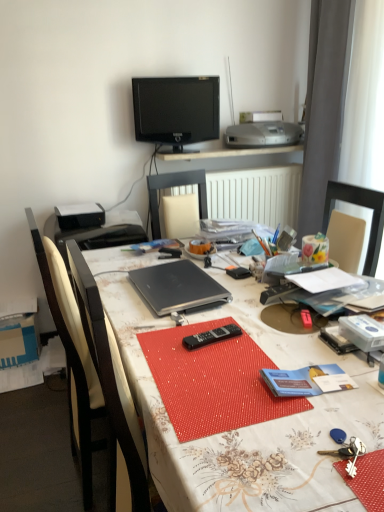
The image size is (384, 512). Describe the element at coordinates (177, 287) in the screenshot. I see `black matte laptop at center` at that location.

Locate an element on the screen. black plastic remote control at center, which is the second stationery from right to left is located at coordinates (239, 273).

What is the approximate width of black plastic remote control at center, the first stationery in the left-to-right sequence?

black plastic remote control at center, the first stationery in the left-to-right sequence, is 4.46 inches in width.

Measure the distance between matte black laptop at center and camera.

matte black laptop at center and camera are 27.18 inches apart from each other.

The height and width of the screenshot is (512, 384). Find the location of `matte black laptop at center`. matte black laptop at center is located at coordinates (246, 426).

I want to click on black glossy television at upper center, so click(176, 110).

This screenshot has width=384, height=512. What do you see at coordinates (264, 133) in the screenshot? I see `satin silver printer at upper center` at bounding box center [264, 133].

Identify the location of satin silver printer at upper center. Image resolution: width=384 pixels, height=512 pixels. [264, 133].

Locate an element on the screen. The image size is (384, 512). black matte laptop at center is located at coordinates (177, 287).

From the image's perspective, is black matte laptop at center positioned above or below black wood chair at left?

Based on their image positions, black matte laptop at center is located above black wood chair at left.

From the picture: Can you confirm if black matte laptop at center is taller than black wood chair at left?

No, black matte laptop at center is not taller than black wood chair at left.

Is black matte laptop at center placed right next to black wood chair at left?

There is a gap between black matte laptop at center and black wood chair at left.

Is black matte laptop at center inside the boundaries of black wood chair at left, or outside?

black matte laptop at center is enclosed within black wood chair at left.

From the image's perspective, is black glossy television at upper center located above matte black laptop at center?

Indeed, from the image's perspective, black glossy television at upper center is shown above matte black laptop at center.

From the picture: From a real-world perspective, is black glossy television at upper center positioned over matte black laptop at center based on gravity?

Yes, from a real-world perspective, black glossy television at upper center is above matte black laptop at center.

Can you confirm if black glossy television at upper center is smaller than matte black laptop at center?

Indeed, black glossy television at upper center has a smaller size compared to matte black laptop at center.

Considering the positions of objects matte black laptop at center and floral paper towel at upper right, which appears as the 1th stationery when viewed from the right, in the image provided, who is more to the right, matte black laptop at center or floral paper towel at upper right, which appears as the 1th stationery when viewed from the right,?

floral paper towel at upper right, which appears as the 1th stationery when viewed from the right.

In order to click on the 2nd stationery directly above the matte black laptop at center (from a real-world perspective) in this screenshot , I will do `click(315, 248)`.

Looking at this image, from a real-world perspective, is matte black laptop at center positioned under floral paper towel at upper right, which appears as the 1th stationery when viewed from the right, based on gravity?

Yes.

Is matte black laptop at center positioned before floral paper towel at upper right, which appears as the 1th stationery when viewed from the right?

Yes, it is in front of floral paper towel at upper right, which appears as the 1th stationery when viewed from the right.

Who is smaller, black plastic remote control at center, which is the second stationery from right to left, or matte black laptop at center?

Smaller between the two is black plastic remote control at center, which is the second stationery from right to left.

Considering the relative sizes of black plastic remote control at center, which is the second stationery from right to left, and matte black laptop at center in the image provided, is black plastic remote control at center, which is the second stationery from right to left, wider than matte black laptop at center?

In fact, black plastic remote control at center, which is the second stationery from right to left, might be narrower than matte black laptop at center.

Considering the sizes of objects black plastic remote control at center, which is the second stationery from right to left, and matte black laptop at center in the image provided, who is shorter, black plastic remote control at center, which is the second stationery from right to left, or matte black laptop at center?

With less height is black plastic remote control at center, which is the second stationery from right to left.

Is black plastic remote control at center, which is the second stationery from right to left, to the right of matte black laptop at center from the viewer's perspective?

In fact, black plastic remote control at center, which is the second stationery from right to left, is to the left of matte black laptop at center.

Between black glossy television at upper center and floral paper towel at upper right, the second stationery when ordered from left to right, which one has larger size?

black glossy television at upper center is bigger.

Can you confirm if black glossy television at upper center is positioned to the right of floral paper towel at upper right, which appears as the 1th stationery when viewed from the right?

In fact, black glossy television at upper center is to the left of floral paper towel at upper right, which appears as the 1th stationery when viewed from the right.

Are black glossy television at upper center and floral paper towel at upper right, the second stationery when ordered from left to right, beside each other?

No, black glossy television at upper center is not touching floral paper towel at upper right, the second stationery when ordered from left to right.

How many degrees apart are the facing directions of black wood chair at left and black glossy television at upper center?

They differ by 72.4 degrees in their facing directions.

Find the location of a particular element. The image size is (384, 512). television that appears above the black wood chair at left (from a real-world perspective) is located at coordinates (176, 110).

In terms of width, does black wood chair at left look wider or thinner when compared to black glossy television at upper center?

Considering their sizes, black wood chair at left looks broader than black glossy television at upper center.

Is black wood chair at left thinner than black matte laptop at center?

No, black wood chair at left is not thinner than black matte laptop at center.

Which is farther from the camera, (79,453) or (184,282)?

The point (79,453) is behind.

Who is shorter, black wood chair at left or black matte laptop at center?

With less height is black matte laptop at center.

Image resolution: width=384 pixels, height=512 pixels. What are the coordinates of `chair below the black matte laptop at center (from a real-world perspective)` in the screenshot? It's located at (94, 379).

Find the location of a particular element. chair in front of the black matte laptop at center is located at coordinates (94, 379).

The image size is (384, 512). Find the location of `desk below the black glossy television at upper center (from a real-world perspective)`. desk below the black glossy television at upper center (from a real-world perspective) is located at coordinates (246, 426).

Looking at the image, which one is located further to black wood chair at left, floral paper towel at upper right, the second stationery when ordered from left to right, or satin silver printer at upper center?

Among the two, satin silver printer at upper center is located further to black wood chair at left.

Based on their spatial positions, is black wood chair at left or satin silver printer at upper center closer to floral paper towel at upper right, the second stationery when ordered from left to right?

black wood chair at left is closer to floral paper towel at upper right, the second stationery when ordered from left to right.

Which object lies nearer to the anchor point black matte laptop at center, black wood chair at left or black plastic remote at center?

black plastic remote at center lies closer to black matte laptop at center than the other object.

Estimate the real-world distances between objects in this image. Which object is closer to matte black laptop at center, black wood chair at left or black plastic remote control at center, the first stationery in the left-to-right sequence?

Based on the image, black wood chair at left appears to be nearer to matte black laptop at center.

Considering their positions, is black plastic remote at center positioned further to black matte laptop at center than floral paper towel at upper right, the second stationery when ordered from left to right?

floral paper towel at upper right, the second stationery when ordered from left to right, is further to black matte laptop at center.

Which object lies nearer to the anchor point black matte laptop at center, floral paper towel at upper right, the second stationery when ordered from left to right, or black plastic remote at center?

black plastic remote at center is positioned closer to the anchor black matte laptop at center.

When comparing their distances from black plastic remote at center, does black matte laptop at center or floral paper towel at upper right, the second stationery when ordered from left to right, seem closer?

black matte laptop at center.

Estimate the real-world distances between objects in this image. Which object is closer to satin silver printer at upper center, black wood chair at left or black plastic remote control at center, which is the second stationery from right to left?

black plastic remote control at center, which is the second stationery from right to left, is closer to satin silver printer at upper center.

Image resolution: width=384 pixels, height=512 pixels. I want to click on stationery located between floral paper towel at upper right, the second stationery when ordered from left to right, and satin silver printer at upper center in the depth direction, so click(x=239, y=273).

Image resolution: width=384 pixels, height=512 pixels. I want to click on laptop located between black wood chair at left and black glossy television at upper center in the depth direction, so click(x=177, y=287).

You are a GUI agent. You are given a task and a screenshot of the screen. Output one action in this format:
    pyautogui.click(x=<x>, y=<y>)
    Task: Click on the television located between black matte laptop at center and satin silver printer at upper center in the depth direction
    The height and width of the screenshot is (512, 384).
    Given the screenshot: What is the action you would take?
    pyautogui.click(x=176, y=110)

This screenshot has width=384, height=512. Find the location of `remote located between matte black laptop at center and floral paper towel at upper right, the second stationery when ordered from left to right, in the depth direction`. remote located between matte black laptop at center and floral paper towel at upper right, the second stationery when ordered from left to right, in the depth direction is located at coordinates (211, 336).